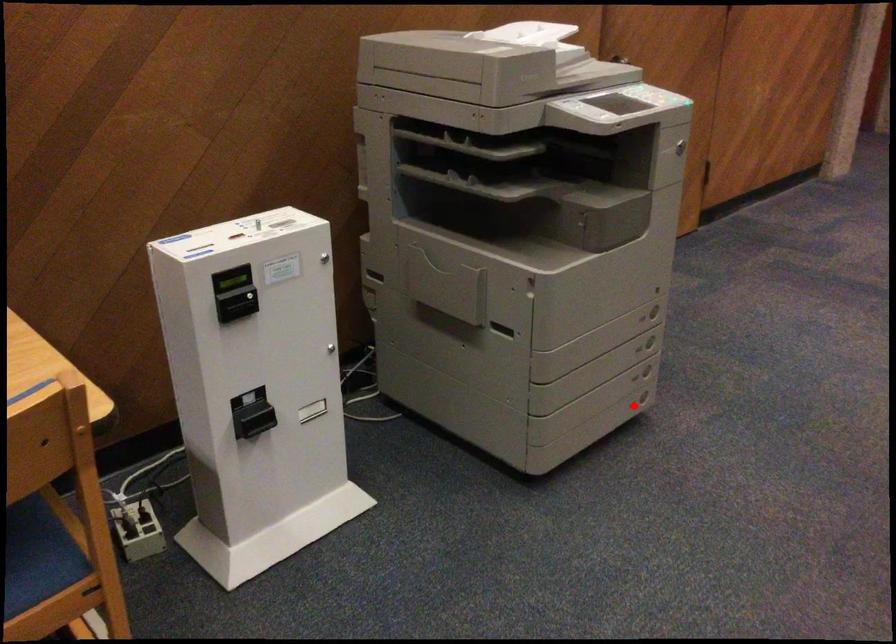
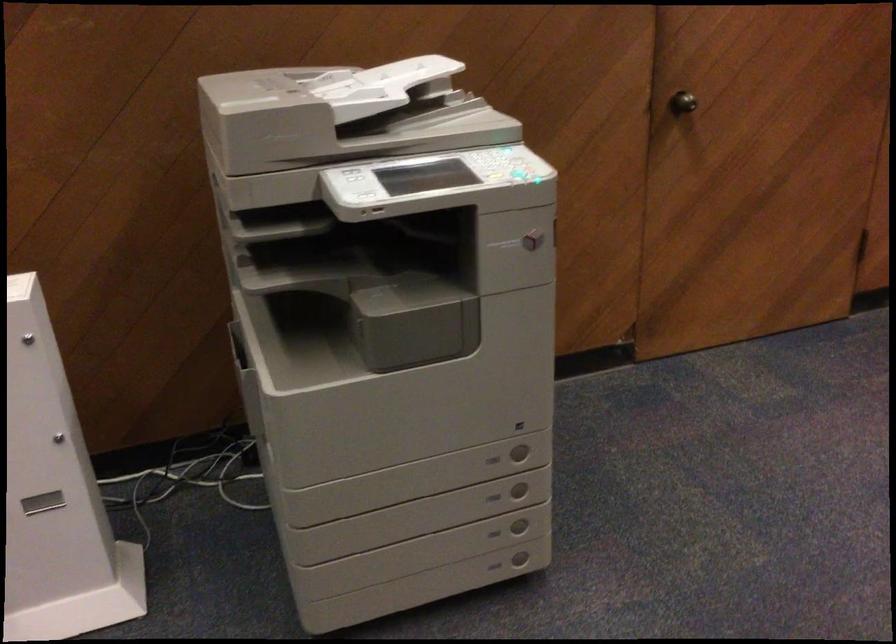
Question: I am providing you with two images of the same scene from different viewpoints. A red point is shown in image1. For the corresponding object point in image2, is it positioned nearer or farther from the camera?

Choices:
 (A) Nearer
 (B) Farther

Answer: (A)